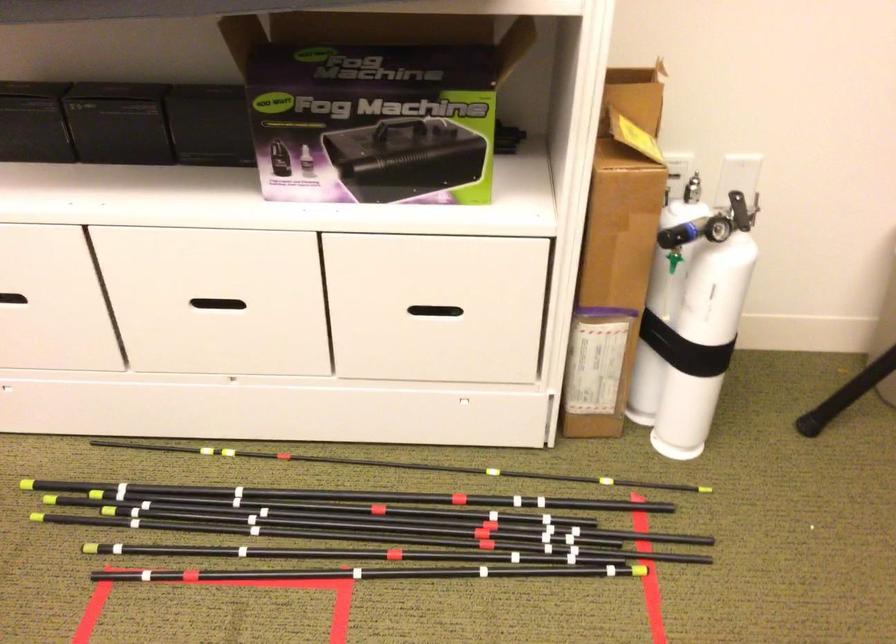
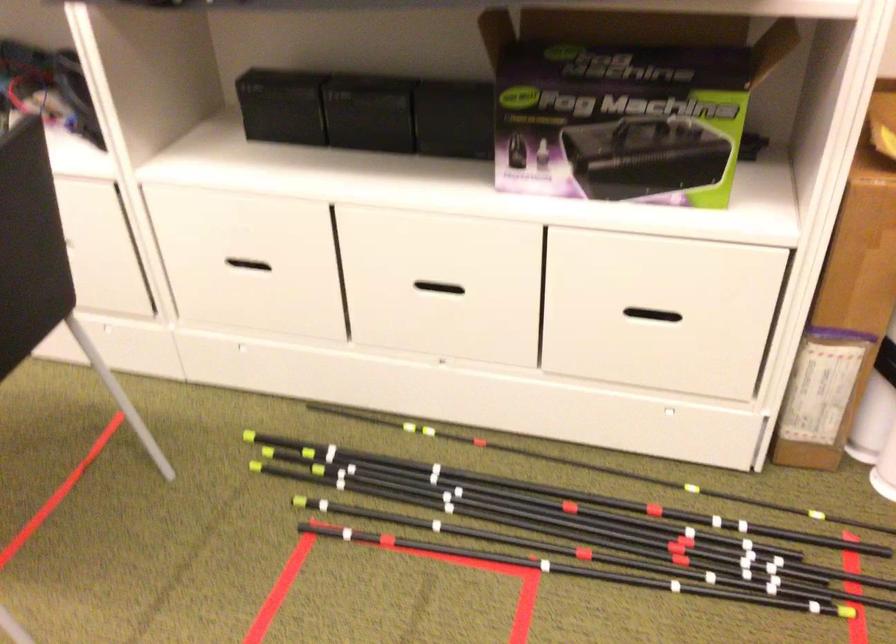
The point at (444,515) is marked in the first image. Where is the corresponding point in the second image?

(638, 524)